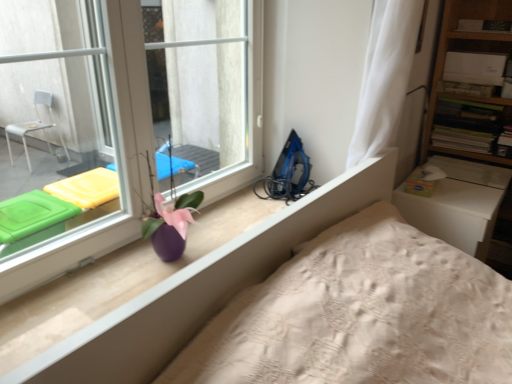
Describe the element at coordinates (288, 173) in the screenshot. I see `blue plastic iron at right` at that location.

In order to face purple glossy vase at center, should I rotate leftwards or rightwards?

Turn left by 10.304 degrees to look at purple glossy vase at center.

What are the coordinates of `wooden bookshelf at upper right` in the screenshot? It's located at (466, 101).

This screenshot has width=512, height=384. What do you see at coordinates (128, 114) in the screenshot?
I see `transparent glass window at upper left` at bounding box center [128, 114].

The width and height of the screenshot is (512, 384). Find the location of `white sheer curtain at upper right`. white sheer curtain at upper right is located at coordinates (385, 77).

In order to click on blue plastic iron at right in this screenshot , I will do `click(288, 173)`.

Considering the relative sizes of purple glossy vase at center and transparent glass window at upper left in the image provided, is purple glossy vase at center wider than transparent glass window at upper left?

Correct, the width of purple glossy vase at center exceeds that of transparent glass window at upper left.

From the image's perspective, which object appears higher, purple glossy vase at center or transparent glass window at upper left?

From the image's view, transparent glass window at upper left is above.

Could you tell me if purple glossy vase at center is facing transparent glass window at upper left?

No, purple glossy vase at center does not turn towards transparent glass window at upper left.

Can you confirm if purple glossy vase at center is bigger than transparent glass window at upper left?

Actually, purple glossy vase at center might be smaller than transparent glass window at upper left.

From a real-world perspective, is purple glossy vase at center on top of wooden bookshelf at upper right?

Yes.

Is purple glossy vase at center completely or partially outside of wooden bookshelf at upper right?

Absolutely, purple glossy vase at center is external to wooden bookshelf at upper right.

Can you confirm if purple glossy vase at center is taller than wooden bookshelf at upper right?

Yes.

Considering the sizes of objects transparent glass window at upper left and blue plastic iron at right in the image provided, who is wider, transparent glass window at upper left or blue plastic iron at right?

Wider between the two is blue plastic iron at right.

Is transparent glass window at upper left with blue plastic iron at right?

transparent glass window at upper left and blue plastic iron at right are clearly separated.

From a real-world perspective, is transparent glass window at upper left under blue plastic iron at right?

No, from a real-world perspective, transparent glass window at upper left is not under blue plastic iron at right.

Is transparent glass window at upper left shorter than blue plastic iron at right?

Incorrect, the height of transparent glass window at upper left does not fall short of that of blue plastic iron at right.

Looking at this image, is white sheer curtain at upper right closer to the viewer compared to wooden bookshelf at upper right?

Yes.

Is wooden bookshelf at upper right at the back of white sheer curtain at upper right?

No, white sheer curtain at upper right's orientation is not away from wooden bookshelf at upper right.

From the image's perspective, is white sheer curtain at upper right above wooden bookshelf at upper right?

Yes, from the image's perspective, white sheer curtain at upper right is above wooden bookshelf at upper right.

Considering the relative sizes of white sheer curtain at upper right and wooden bookshelf at upper right in the image provided, is white sheer curtain at upper right shorter than wooden bookshelf at upper right?

In fact, white sheer curtain at upper right may be taller than wooden bookshelf at upper right.

Is blue plastic iron at right thinner than transparent glass window at upper left?

In fact, blue plastic iron at right might be wider than transparent glass window at upper left.

Considering the sizes of blue plastic iron at right and transparent glass window at upper left in the image, is blue plastic iron at right bigger or smaller than transparent glass window at upper left?

blue plastic iron at right is smaller than transparent glass window at upper left.

Find the location of `window above the blue plastic iron at right (from the image's perspective)`. window above the blue plastic iron at right (from the image's perspective) is located at coordinates (128, 114).

Between wooden bookshelf at upper right and white sheer curtain at upper right, which one has more height?

With more height is white sheer curtain at upper right.

Is wooden bookshelf at upper right positioned with its back to white sheer curtain at upper right?

No, wooden bookshelf at upper right's orientation is not away from white sheer curtain at upper right.

Where is `curtain above the wooden bookshelf at upper right (from a real-world perspective)`? This screenshot has height=384, width=512. curtain above the wooden bookshelf at upper right (from a real-world perspective) is located at coordinates (385, 77).

From a real-world perspective, is wooden bookshelf at upper right physically located above or below white sheer curtain at upper right?

wooden bookshelf at upper right is situated lower than white sheer curtain at upper right in the real world.

Is purple glossy vase at center at the back of white sheer curtain at upper right?

That's not correct — white sheer curtain at upper right is not looking away from purple glossy vase at center.

Can you tell me how much white sheer curtain at upper right and purple glossy vase at center differ in facing direction?

The angular difference between white sheer curtain at upper right and purple glossy vase at center is 2.35 degrees.

From a real-world perspective, relative to purple glossy vase at center, is white sheer curtain at upper right vertically above or below?

white sheer curtain at upper right is situated higher than purple glossy vase at center in the real world.

Which object is further away from the camera taking this photo, white sheer curtain at upper right or purple glossy vase at center?

Positioned behind is white sheer curtain at upper right.

Where is `window on the left of purple glossy vase at center`? window on the left of purple glossy vase at center is located at coordinates tap(128, 114).

What are the coordinates of `shelf located behind the purple glossy vase at center` in the screenshot? It's located at (466, 101).

When comparing their distances from white sheer curtain at upper right, does blue plastic iron at right or transparent glass window at upper left seem closer?

Among the two, blue plastic iron at right is located nearer to white sheer curtain at upper right.

Based on their spatial positions, is transparent glass window at upper left or purple glossy vase at center further from blue plastic iron at right?

purple glossy vase at center is further to blue plastic iron at right.

Estimate the real-world distances between objects in this image. Which object is further from transparent glass window at upper left, purple glossy vase at center or white sheer curtain at upper right?

Among the two, white sheer curtain at upper right is located further to transparent glass window at upper left.

Which object lies nearer to the anchor point white sheer curtain at upper right, transparent glass window at upper left or blue plastic iron at right?

blue plastic iron at right is positioned closer to the anchor white sheer curtain at upper right.

Considering their positions, is blue plastic iron at right positioned closer to purple glossy vase at center than wooden bookshelf at upper right?

blue plastic iron at right lies closer to purple glossy vase at center than the other object.

Which object lies nearer to the anchor point transparent glass window at upper left, wooden bookshelf at upper right or blue plastic iron at right?

Among the two, blue plastic iron at right is located nearer to transparent glass window at upper left.

Based on the photo, looking at the image, which one is located closer to blue plastic iron at right, wooden bookshelf at upper right or white sheer curtain at upper right?

white sheer curtain at upper right lies closer to blue plastic iron at right than the other object.

Considering their positions, is purple glossy vase at center positioned closer to white sheer curtain at upper right than wooden bookshelf at upper right?

Based on the image, purple glossy vase at center appears to be nearer to white sheer curtain at upper right.

Identify the location of equipment between purple glossy vase at center and white sheer curtain at upper right from left to right. This screenshot has width=512, height=384. (288, 173).

Identify the location of equipment situated between transparent glass window at upper left and wooden bookshelf at upper right from left to right. (288, 173).

Find the location of a particular element. plant situated between transparent glass window at upper left and wooden bookshelf at upper right from left to right is located at coordinates (170, 205).

Where is `equipment between purple glossy vase at center and wooden bookshelf at upper right in the horizontal direction`? equipment between purple glossy vase at center and wooden bookshelf at upper right in the horizontal direction is located at coordinates (288, 173).